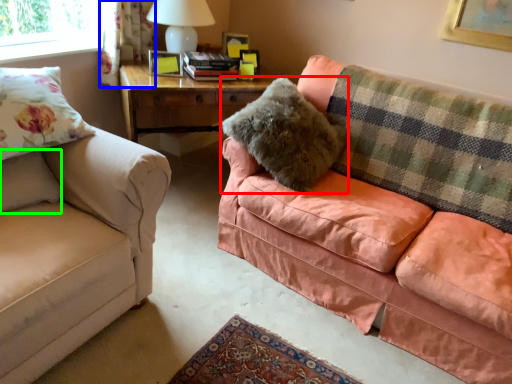
Question: Estimate the real-world distances between objects in this image. Which object is closer to pillow (highlighted by a red box), curtain (highlighted by a blue box) or pillow (highlighted by a green box)?

Choices:
 (A) curtain
 (B) pillow

Answer: (B)